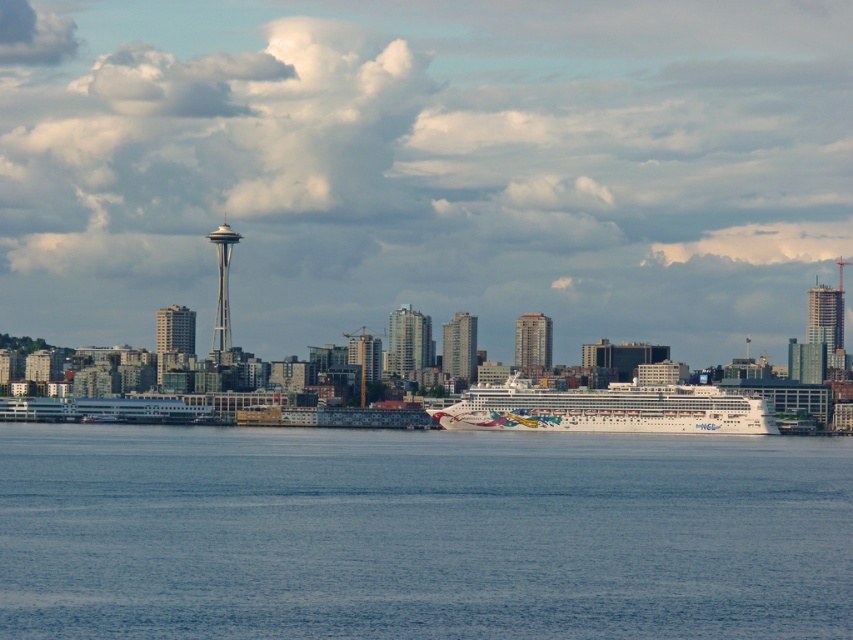
Is the position of blue water at center more distant than that of glassy steel skyscraper at right?

No.

Between blue water at center and glassy steel skyscraper at right, which one has less height?

glassy steel skyscraper at right

Who is more distant from viewer, (779, 504) or (837, 301)?

The point (837, 301) is behind.

Locate an element on the screen. Image resolution: width=853 pixels, height=640 pixels. blue water at center is located at coordinates (421, 532).

Is blue water at center bigger than green glass building at center?

Yes.

You are a GUI agent. You are given a task and a screenshot of the screen. Output one action in this format:
    pyautogui.click(x=<x>, y=<y>)
    Task: Click on the blue water at center
    The width and height of the screenshot is (853, 640).
    Given the screenshot: What is the action you would take?
    pyautogui.click(x=421, y=532)

Locate an element on the screen. This screenshot has width=853, height=640. blue water at center is located at coordinates (421, 532).

Between point (532, 428) and point (221, 291), which one is positioned behind?

Point (221, 291)

Is white glossy cruise ship at center closer to the viewer compared to white glass space needle at center?

That is True.

Does point (465, 417) come closer to viewer compared to point (218, 301)?

Yes, point (465, 417) is closer to viewer.

The width and height of the screenshot is (853, 640). I want to click on white glossy cruise ship at center, so click(x=608, y=410).